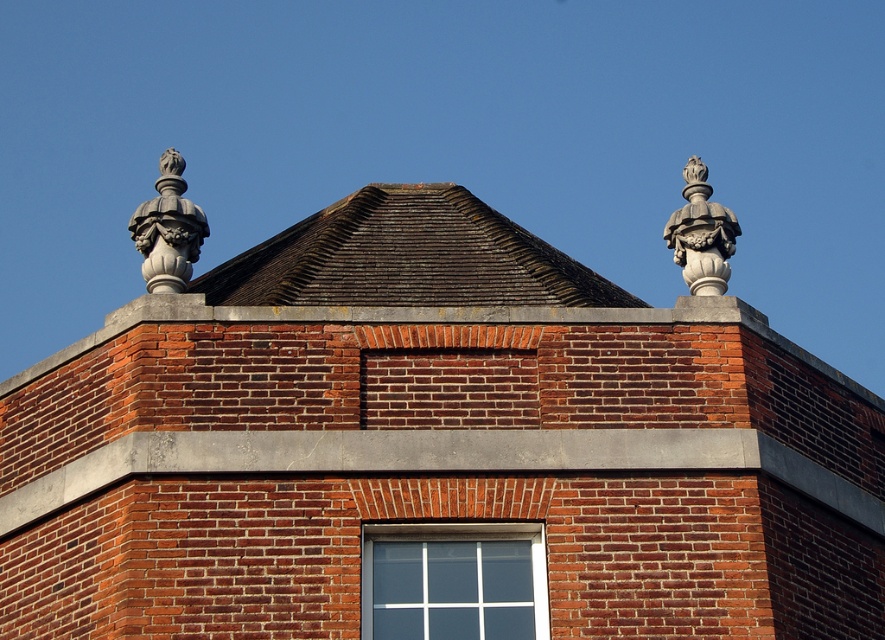
Can you confirm if brown shingles at center is shorter than white stone ornament at upper right?

Indeed, brown shingles at center has a lesser height compared to white stone ornament at upper right.

Is brown shingles at center smaller than white stone ornament at upper right?

No, brown shingles at center is not smaller than white stone ornament at upper right.

Where is `brown shingles at center`? Image resolution: width=885 pixels, height=640 pixels. brown shingles at center is located at coordinates (406, 257).

At what (x,y) coordinates should I click in order to perform the action: click on brown shingles at center. Please return your answer as a coordinate pair (x, y). Looking at the image, I should click on (406, 257).

Describe the element at coordinates (406, 257) in the screenshot. I see `brown shingles at center` at that location.

Between point (447, 262) and point (190, 253), which one is positioned behind?

The point (447, 262) is behind.

The image size is (885, 640). Find the location of `brown shingles at center`. brown shingles at center is located at coordinates (406, 257).

Does point (158, 186) come in front of point (695, 285)?

No, it is behind (695, 285).

Is gray stone finial at upper left below white stone ornament at upper right?

No, gray stone finial at upper left is not below white stone ornament at upper right.

Where is `gray stone finial at upper left`? The height and width of the screenshot is (640, 885). gray stone finial at upper left is located at coordinates (168, 228).